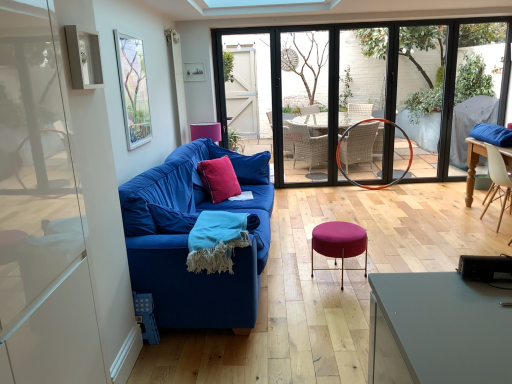
From the picture: How much space does transparent glass door at center, arranged as the 1th glass door when viewed from the right, occupy vertically?

transparent glass door at center, arranged as the 1th glass door when viewed from the right, is 1.83 meters in height.

What is the approximate width of white wood chair at right?

The width of white wood chair at right is 17.66 inches.

What do you see at coordinates (219, 179) in the screenshot? I see `velvet red pillow at center` at bounding box center [219, 179].

The image size is (512, 384). What do you see at coordinates (339, 243) in the screenshot? I see `purple fabric stool at center` at bounding box center [339, 243].

Locate an element on the screen. turquoise woven blanket at center is located at coordinates (216, 241).

What do you see at coordinates (421, 90) in the screenshot? This screenshot has height=384, width=512. I see `clear glass window at center` at bounding box center [421, 90].

The image size is (512, 384). Find the location of `matte glass window screen at upper left`. matte glass window screen at upper left is located at coordinates (133, 89).

Locate an element on the screen. transparent glass door at center, arranged as the 1th glass door when viewed from the right is located at coordinates (366, 90).

Is purple fabric stool at center oriented towards velvet red pillow at center?

No.

Would you say purple fabric stool at center contains velvet red pillow at center?

No.

Where is `bar stool that appears below the velvet red pillow at center (from the image's perspective)`? The height and width of the screenshot is (384, 512). bar stool that appears below the velvet red pillow at center (from the image's perspective) is located at coordinates (339, 243).

Is purple fabric stool at center thinner than velvet red pillow at center?

Incorrect, the width of purple fabric stool at center is not less than that of velvet red pillow at center.

Measure the distance between transparent glass door at center, which is counted as the second glass door, starting from the left, and matte glass window screen at upper left.

2.84 meters.

Is transparent glass door at center, arranged as the 1th glass door when viewed from the right, bigger or smaller than matte glass window screen at upper left?

Clearly, transparent glass door at center, arranged as the 1th glass door when viewed from the right, is larger in size than matte glass window screen at upper left.

What's the angular difference between transparent glass door at center, which is counted as the second glass door, starting from the left, and matte glass window screen at upper left's facing directions?

They differ by 89.2 degrees in their facing directions.

From a real-world perspective, between transparent glass door at center, which is counted as the second glass door, starting from the left, and matte glass window screen at upper left, who is vertically higher?

From a 3D spatial view, matte glass window screen at upper left is above.

Which object is positioned more to the right, purple fabric stool at center or blue fabric couch at center?

From the viewer's perspective, purple fabric stool at center appears more on the right side.

Measure the distance from purple fabric stool at center to blue fabric couch at center.

purple fabric stool at center is 2.69 meters from blue fabric couch at center.

From a real-world perspective, is purple fabric stool at center positioned above or below blue fabric couch at center?

Clearly, from a real-world perspective, purple fabric stool at center is below blue fabric couch at center.

Does point (218, 265) come behind point (116, 32)?

No, it is not.

Is turquoise woven blanket at center at the left side of matte glass window screen at upper left?

No.

Would you say turquoise woven blanket at center is inside or outside matte glass window screen at upper left?

turquoise woven blanket at center is not inside matte glass window screen at upper left, it's outside.

Is turquoise woven blanket at center in front of or behind matte glass window screen at upper left in the image?

turquoise woven blanket at center is in front of matte glass window screen at upper left.

What's the angular difference between blue fabric couch at left and transparent glass door at center, which is counted as the second glass door, starting from the left,'s facing directions?

The angle between the facing direction of blue fabric couch at left and the facing direction of transparent glass door at center, which is counted as the second glass door, starting from the left, is 88.1 degrees.

Is blue fabric couch at left to the right of transparent glass door at center, which is counted as the second glass door, starting from the left, from the viewer's perspective?

No.

How much distance is there between blue fabric couch at left and transparent glass door at center, which is counted as the second glass door, starting from the left?

2.08 meters.

Can you confirm if blue fabric couch at left is thinner than transparent glass door at center, arranged as the 1th glass door when viewed from the right?

Incorrect, the width of blue fabric couch at left is not less than that of transparent glass door at center, arranged as the 1th glass door when viewed from the right.

How many degrees apart are the facing directions of transparent glass door at center, the 2th glass door viewed from the right, and pink fabric lampshade at center?

They differ by 80 degrees in their facing directions.

Based on the photo, which is correct: transparent glass door at center, the 2th glass door viewed from the right, is inside pink fabric lampshade at center, or outside of it?

transparent glass door at center, the 2th glass door viewed from the right, is not inside pink fabric lampshade at center, it's outside.

Would you consider transparent glass door at center, the 2th glass door viewed from the right, to be distant from pink fabric lampshade at center?

Yes, transparent glass door at center, the 2th glass door viewed from the right, and pink fabric lampshade at center are located far from each other.

Does transparent glass door at center, the 2th glass door viewed from the right, lie behind pink fabric lampshade at center?

Yes, the depth of transparent glass door at center, the 2th glass door viewed from the right, is greater than that of pink fabric lampshade at center.

Is point (224, 271) positioned behind point (131, 274)?

That is False.

Which is more to the left, turquoise woven blanket at center or blue fabric couch at left?

From the viewer's perspective, blue fabric couch at left appears more on the left side.

Is turquoise woven blanket at center touching blue fabric couch at left?

turquoise woven blanket at center and blue fabric couch at left are not in contact.

Could you tell me if turquoise woven blanket at center is facing blue fabric couch at left?

Yes, turquoise woven blanket at center is oriented towards blue fabric couch at left.

Find the location of a particular element. This screenshot has width=512, height=384. pillow above the purple fabric stool at center (from a real-world perspective) is located at coordinates (219, 179).

Find the location of a particular element. window screen on the left side of transparent glass door at center, which is counted as the second glass door, starting from the left is located at coordinates (133, 89).

Based on their spatial positions, is matte glass window screen at upper left or purple fabric stool at center further from clear glass window at center?

The object further to clear glass window at center is matte glass window screen at upper left.

From the image, which object appears to be nearer to velvet red pillow at center, clear glass window at center or blue fabric couch at left?

blue fabric couch at left is positioned closer to the anchor velvet red pillow at center.

When comparing their distances from black plastic speaker at lower right, does blue fabric couch at left or turquoise woven blanket at center seem further?

blue fabric couch at left.

Estimate the real-world distances between objects in this image. Which object is further from blue fabric couch at left, pink fabric lampshade at center or white wood chair at right?

white wood chair at right is positioned further to the anchor blue fabric couch at left.

When comparing their distances from white wood chair at right, does black plastic speaker at lower right or purple fabric stool at center seem further?

black plastic speaker at lower right.

When comparing their distances from pink fabric lampshade at center, does transparent glass door at center, which is counted as the second glass door, starting from the left, or white wood chair at right seem further?

Among the two, white wood chair at right is located further to pink fabric lampshade at center.

Which object lies nearer to the anchor point clear glass window at center, white wood chair at right or turquoise woven blanket at center?

white wood chair at right.

When comparing their distances from clear glass window at center, does blue fabric couch at center or black plastic speaker at lower right seem closer?

blue fabric couch at center lies closer to clear glass window at center than the other object.

In order to click on window screen between blue fabric couch at left and transparent glass door at center, which is counted as the first glass door, starting from the left, in the front-back direction in this screenshot , I will do `click(133, 89)`.

Where is `bar stool between velvet red pillow at center and clear glass window at center from left to right`? This screenshot has width=512, height=384. bar stool between velvet red pillow at center and clear glass window at center from left to right is located at coordinates (339, 243).

Identify the location of bar stool between pink fabric lampshade at center and white wood chair at right from left to right. (339, 243).

Identify the location of chair between black plastic speaker at lower right and pink fabric lampshade at center along the z-axis. The width and height of the screenshot is (512, 384). (498, 182).